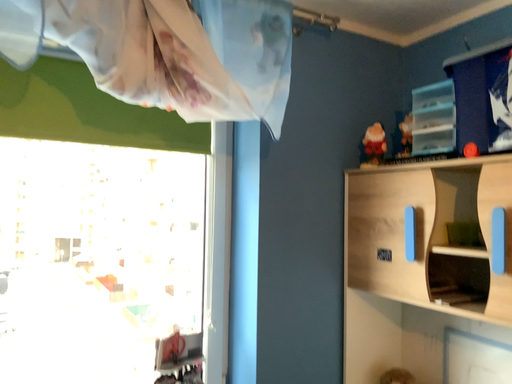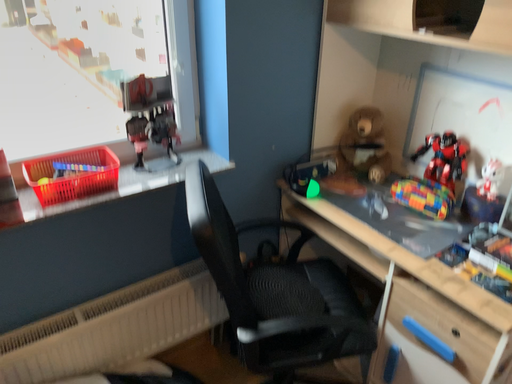
Question: Which way did the camera rotate in the video?

Choices:
 (A) rotated upward
 (B) rotated downward

Answer: (B)